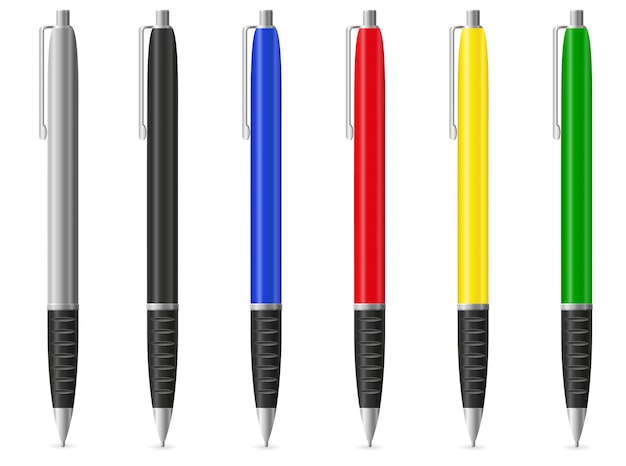
Where is `pens`? pens is located at coordinates (67, 246), (158, 244), (265, 246), (372, 247), (478, 249), (576, 243).